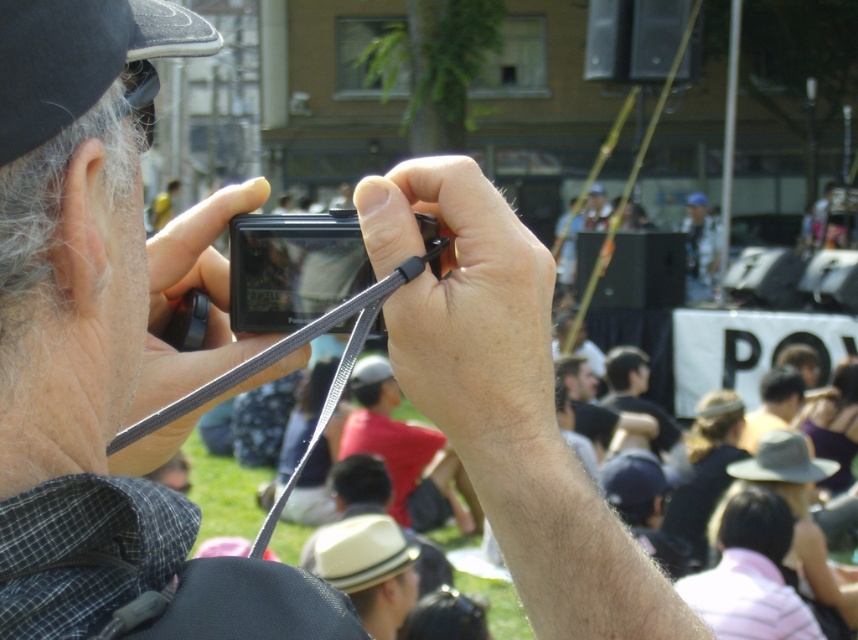
Is point (432, 234) positioned in front of point (705, 266)?

Yes.

Does black plastic camera at center lie in front of blue fabric shirt at upper center?

Yes, it is.

Measure the distance between point (x=343, y=236) and camera.

Point (x=343, y=236) and camera are 3.62 feet apart from each other.

You are a GUI agent. You are given a task and a screenshot of the screen. Output one action in this format:
    pyautogui.click(x=<x>, y=<y>)
    Task: Click on the black plastic camera at center
    This screenshot has height=640, width=858.
    Given the screenshot: What is the action you would take?
    pyautogui.click(x=293, y=268)